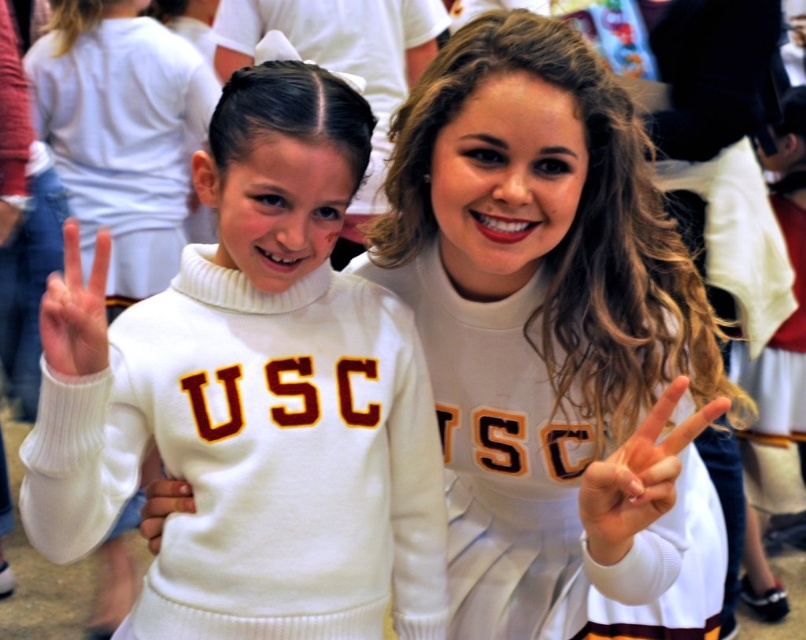
How much distance is there between white matte hand at center and white matte hand at left?

white matte hand at center and white matte hand at left are 21.11 inches apart from each other.

Can you confirm if white matte hand at center is positioned to the right of white matte hand at left?

Indeed, white matte hand at center is positioned on the right side of white matte hand at left.

Does point (630, 476) lie in front of point (89, 364)?

Yes, it is.

Locate an element on the screen. This screenshot has width=806, height=640. white matte hand at center is located at coordinates (638, 476).

Between white turtleneck sweater at left and white soft hand at center, which one appears on the left side from the viewer's perspective?

white soft hand at center

Which is behind, point (75, 508) or point (158, 524)?

The point (158, 524) is behind.

This screenshot has height=640, width=806. What do you see at coordinates (260, 401) in the screenshot?
I see `white turtleneck sweater at left` at bounding box center [260, 401].

Locate an element on the screen. white turtleneck sweater at left is located at coordinates (260, 401).

Can you confirm if white matte hand at left is wider than white soft hand at center?

Indeed, white matte hand at left has a greater width compared to white soft hand at center.

Does white matte hand at left have a smaller size compared to white soft hand at center?

Incorrect, white matte hand at left is not smaller in size than white soft hand at center.

Describe the element at coordinates (77, 308) in the screenshot. I see `white matte hand at left` at that location.

This screenshot has width=806, height=640. I want to click on white matte hand at left, so click(x=77, y=308).